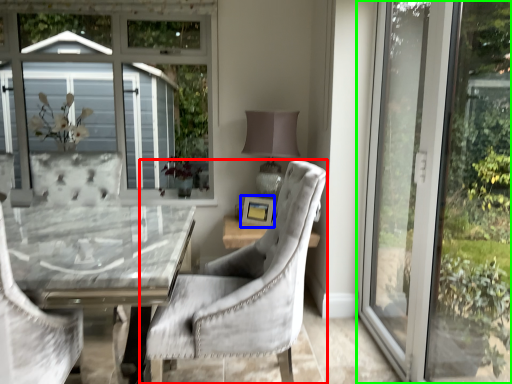
Question: Estimate the real-world distances between objects in this image. Which object is farther from chair (highlighted by a red box), picture frame (highlighted by a blue box) or window (highlighted by a green box)?

Choices:
 (A) picture frame
 (B) window

Answer: (A)